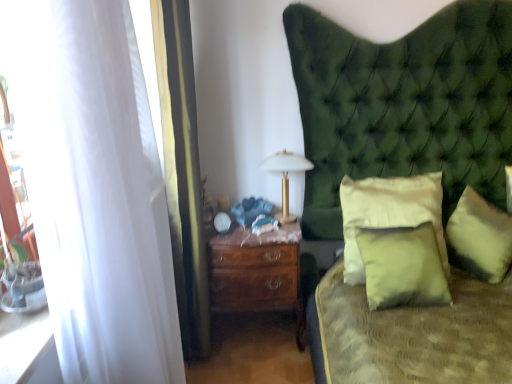
You are a GUI agent. You are given a task and a screenshot of the screen. Output one action in this format:
    pyautogui.click(x=<x>, y=<y>)
    Task: Click on the free space above mahogany wood nightstand at center (from a real-world perspective)
    Image resolution: width=512 pixels, height=384 pixels.
    Given the screenshot: What is the action you would take?
    pyautogui.click(x=255, y=233)